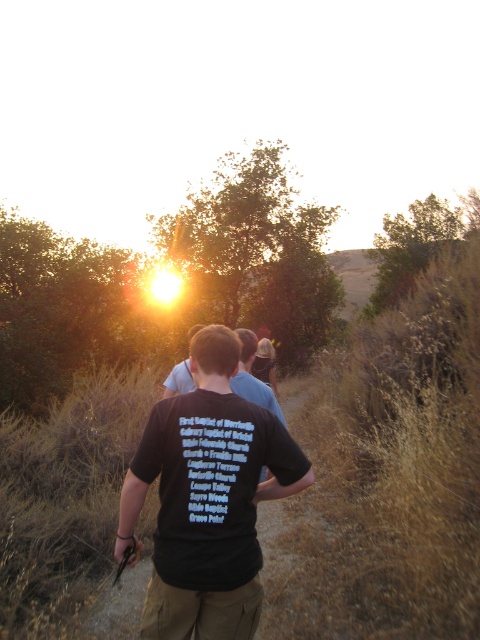
Question: Can you confirm if black t-shirt at center is wider than matte blue shirt at center?

Choices:
 (A) yes
 (B) no

Answer: (B)

Question: Which object is closer to the camera taking this photo?

Choices:
 (A) black t-shirt at center
 (B) matte blue shirt at center
 (C) dark blue t-shirt at center

Answer: (A)

Question: Where is black t-shirt at center located in relation to matte blue shirt at center in the image?

Choices:
 (A) below
 (B) above

Answer: (A)

Question: Can you confirm if black t-shirt at center is thinner than dark blue t-shirt at center?

Choices:
 (A) yes
 (B) no

Answer: (B)

Question: Which object is the closest to the dark blue t-shirt at center?

Choices:
 (A) black t-shirt at center
 (B) matte blue shirt at center

Answer: (A)

Question: Which object appears farthest from the camera in this image?

Choices:
 (A) matte blue shirt at center
 (B) black t-shirt at center
 (C) dark blue t-shirt at center

Answer: (A)